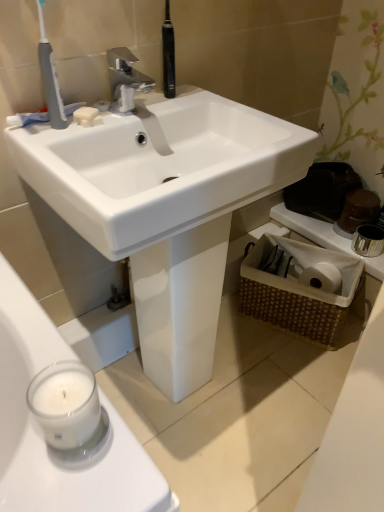
Find the location of a particular element. vacant space to the left of woven brown basket at lower right is located at coordinates (242, 337).